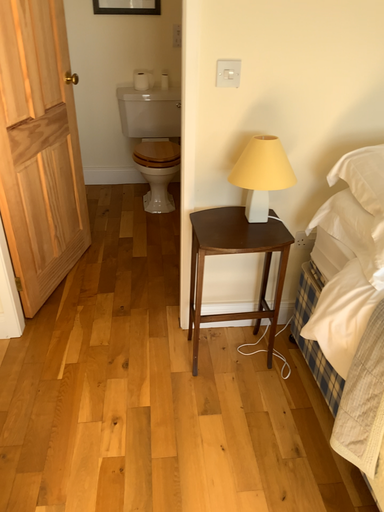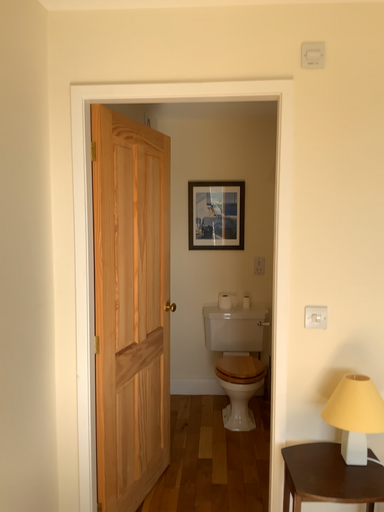
Question: How did the camera likely rotate when shooting the video?

Choices:
 (A) rotated left
 (B) rotated right

Answer: (A)